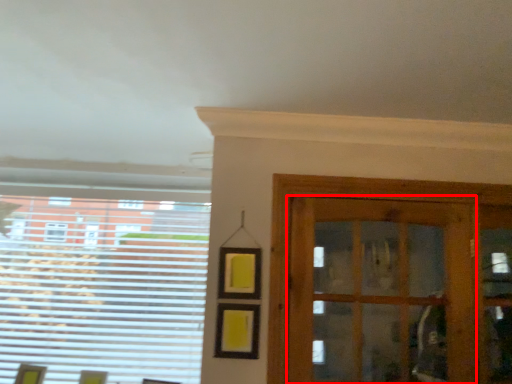
Question: From the image's perspective, where is door (annotated by the red box) located relative to window?

Choices:
 (A) above
 (B) below

Answer: (A)